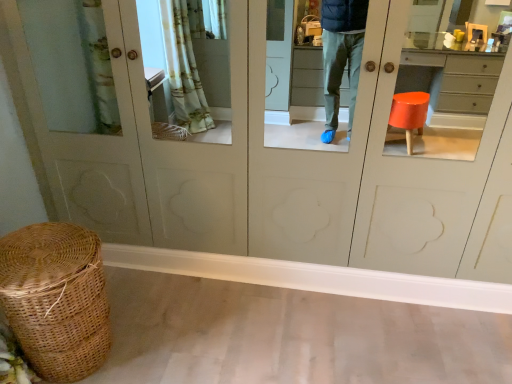
What do you see at coordinates (56, 299) in the screenshot? I see `woven brown basket at lower left` at bounding box center [56, 299].

You are a GUI agent. You are given a task and a screenshot of the screen. Output one action in this format:
    pyautogui.click(x=<x>, y=<y>)
    Task: Click on the woven brown basket at lower left
    The height and width of the screenshot is (384, 512).
    Given the screenshot: What is the action you would take?
    pyautogui.click(x=56, y=299)

What is the approximate width of woven brown basket at lower left?

Answer: 49.24 centimeters.

You are a GUI agent. You are given a task and a screenshot of the screen. Output one action in this format:
    pyautogui.click(x=<x>, y=<y>)
    Task: Click on the woven brown basket at lower left
    Image resolution: width=512 pixels, height=384 pixels.
    Given the screenshot: What is the action you would take?
    pyautogui.click(x=56, y=299)